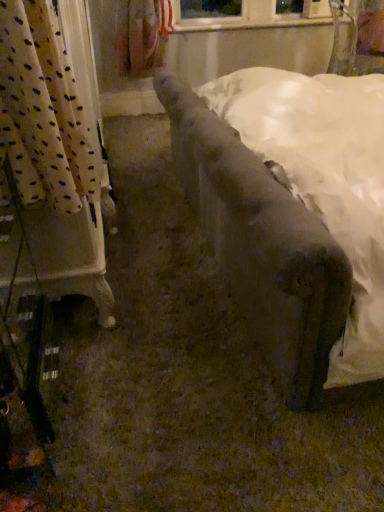
In order to click on textured gray headboard at center in this screenshot , I will do `click(265, 247)`.

Describe the element at coordinates (265, 247) in the screenshot. Image resolution: width=384 pixels, height=512 pixels. I see `textured gray headboard at center` at that location.

Identify the location of textured gray headboard at center. (265, 247).